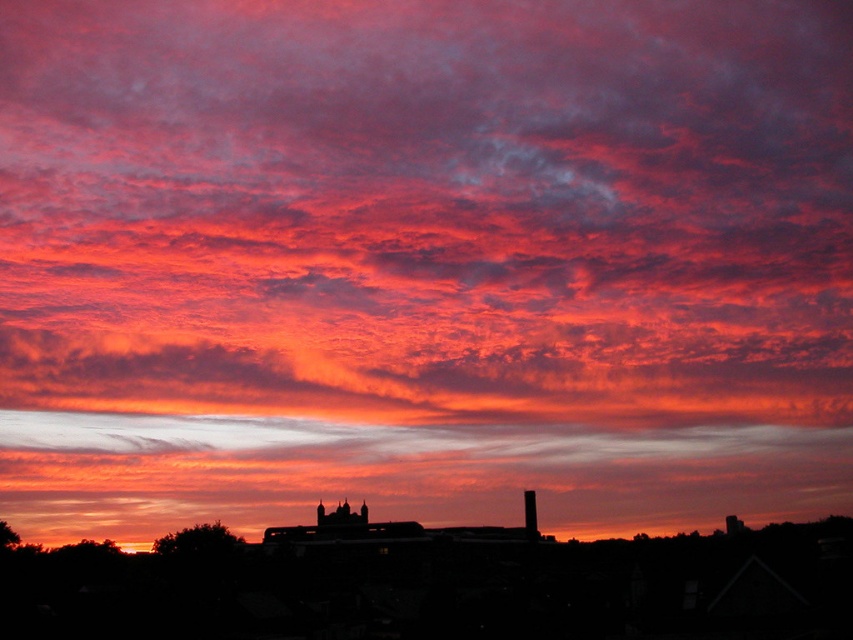
In the scene shown: Is black matte chimney at center above black brick chimney at center?

No, black matte chimney at center is not above black brick chimney at center.

Is black matte chimney at center taller than black brick chimney at center?

Incorrect, black matte chimney at center's height is not larger of black brick chimney at center's.

In order to click on black matte chimney at center in this screenshot , I will do `click(341, 515)`.